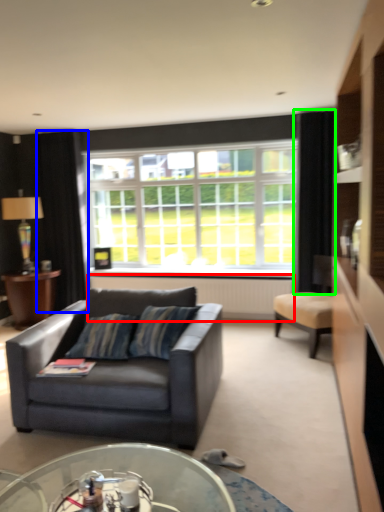
Question: Based on their relative distances, which object is nearer to radiator (highlighted by a red box)? Choose from curtain (highlighted by a blue box) and curtain (highlighted by a green box).

Choices:
 (A) curtain
 (B) curtain

Answer: (B)